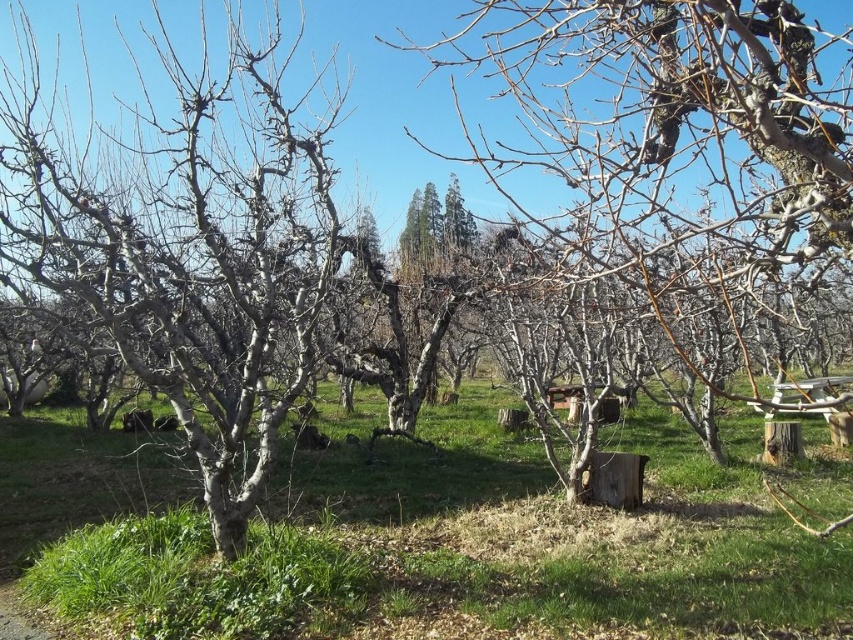
Is green grassy at center closer to camera compared to smooth bark tree at center?

No.

Looking at this image, does green grassy at center appear on the right side of smooth bark tree at center?

Incorrect, green grassy at center is not on the right side of smooth bark tree at center.

Is point (64, 545) farther from viewer compared to point (653, 35)?

Yes, it is behind point (653, 35).

This screenshot has width=853, height=640. In order to click on green grassy at center in this screenshot , I will do `click(428, 536)`.

Between point (759, 102) and point (148, 177), which one is positioned in front?

Point (759, 102) is more forward.

Identify the location of smooth bark tree at center. This screenshot has width=853, height=640. (670, 131).

Between point (192, 477) and point (178, 145), which one is positioned in front?

Point (178, 145) is more forward.

Consider the image. Is green grassy at center above smooth gray tree at center?

Actually, green grassy at center is below smooth gray tree at center.

This screenshot has width=853, height=640. In order to click on green grassy at center in this screenshot , I will do `click(428, 536)`.